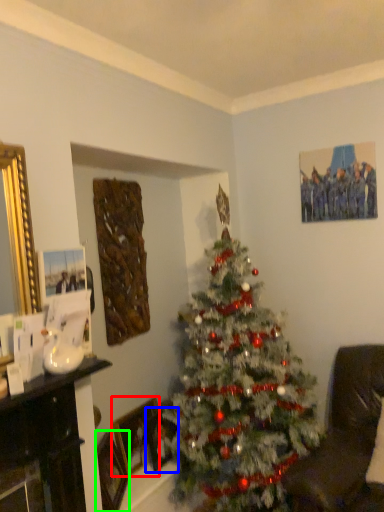
Question: Which is farther away from picture frame (highlighted by a red box)? picture frame (highlighted by a blue box) or picture frame (highlighted by a green box)?

Choices:
 (A) picture frame
 (B) picture frame

Answer: (B)